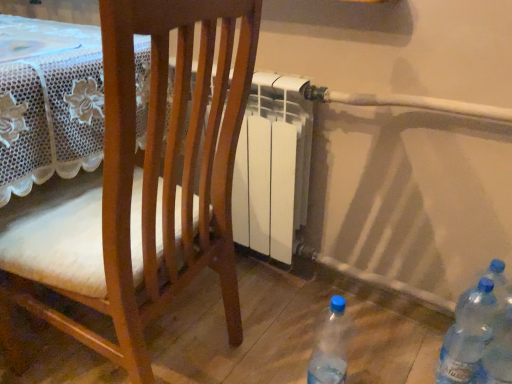
What are the coordinates of `free spot behind transparent plastic bottle at lower right, marked as the first bottle in a left-to-right arrangement` in the screenshot? It's located at (302, 342).